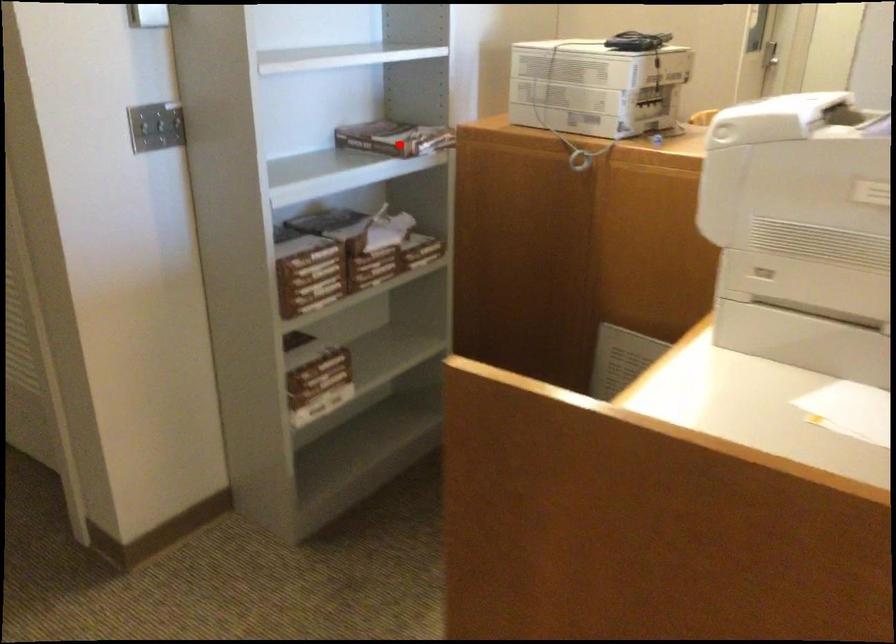
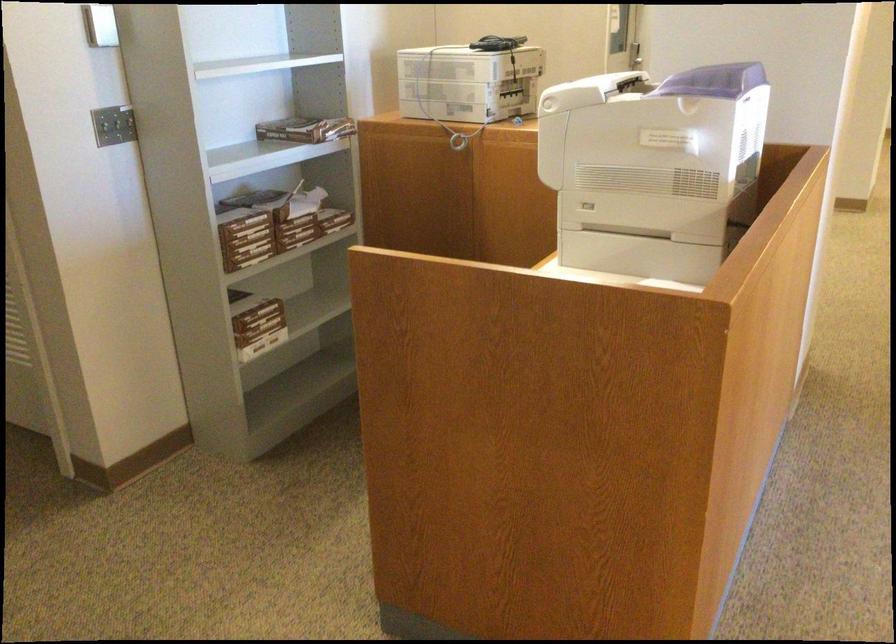
Question: I am providing you with two images of the same scene from different viewpoints. Given a red point in image1, look at the same physical point in image2. Is it:

Choices:
 (A) Closer to the viewpoint
 (B) Farther from the viewpoint

Answer: (B)